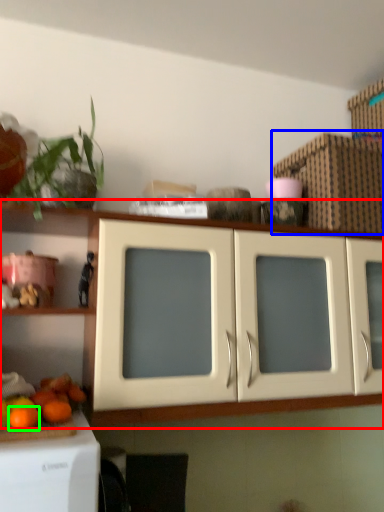
Question: Estimate the real-world distances between objects in this image. Which object is closer to cabinetry (highlighted by a red box), cardboard box (highlighted by a blue box) or orange (highlighted by a green box)?

Choices:
 (A) cardboard box
 (B) orange

Answer: (B)